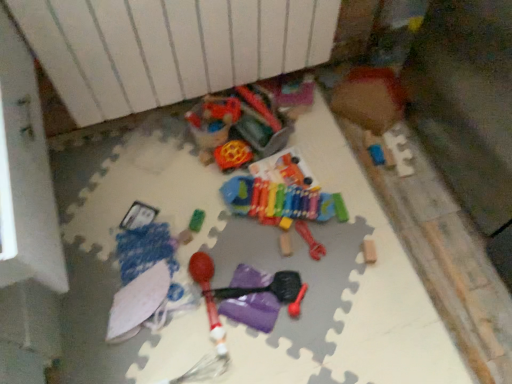
Question: Does green rubber toy at center, which is the 4th toy from top to bottom, come behind white matte umbrella at lower left, arranged as the second toy when ordered from the bottom?

Choices:
 (A) no
 (B) yes

Answer: (B)

Question: From a real-world perspective, does green rubber toy at center, which is the 4th toy from top to bottom, sit lower than white matte umbrella at lower left, arranged as the second toy when ordered from the bottom?

Choices:
 (A) yes
 (B) no

Answer: (B)

Question: Can you confirm if green rubber toy at center, positioned as the 6th toy in bottom-to-top order, is thinner than white matte umbrella at lower left, the eighth toy positioned from the top?

Choices:
 (A) yes
 (B) no

Answer: (A)

Question: Could you tell me if green rubber toy at center, which is the 4th toy from top to bottom, is facing white matte umbrella at lower left, arranged as the second toy when ordered from the bottom?

Choices:
 (A) yes
 (B) no

Answer: (B)

Question: Is green rubber toy at center, positioned as the 6th toy in bottom-to-top order, outside of white matte umbrella at lower left, arranged as the second toy when ordered from the bottom?

Choices:
 (A) yes
 (B) no

Answer: (A)

Question: Is wooden puzzle piece at upper right, the ninth toy from the bottom, wider or thinner than rubberized plastic ball at center, which ranks as the 2th toy in top-to-bottom order?

Choices:
 (A) thin
 (B) wide

Answer: (B)

Question: Is wooden puzzle piece at upper right, the first toy viewed from the top, inside or outside of rubberized plastic ball at center, which ranks as the 2th toy in top-to-bottom order?

Choices:
 (A) inside
 (B) outside

Answer: (B)

Question: From the image's perspective, is wooden puzzle piece at upper right, the ninth toy from the bottom, located above or below rubberized plastic ball at center, which ranks as the 2th toy in top-to-bottom order?

Choices:
 (A) above
 (B) below

Answer: (A)

Question: Is wooden puzzle piece at upper right, the ninth toy from the bottom, taller or shorter than rubberized plastic ball at center, the eighth toy positioned from the bottom?

Choices:
 (A) tall
 (B) short

Answer: (A)

Question: Is green rubber toy at center, which is the 4th toy from top to bottom, in front of or behind wooden puzzle piece at upper right, the first toy viewed from the top, in the image?

Choices:
 (A) front
 (B) behind

Answer: (A)

Question: Is point (190, 230) closer or farther from the camera than point (353, 79)?

Choices:
 (A) farther
 (B) closer

Answer: (B)

Question: Is green rubber toy at center, which is the 4th toy from top to bottom, bigger or smaller than wooden puzzle piece at upper right, the first toy viewed from the top?

Choices:
 (A) big
 (B) small

Answer: (B)

Question: Would you say green rubber toy at center, which is the 4th toy from top to bottom, is inside or outside wooden puzzle piece at upper right, the ninth toy from the bottom?

Choices:
 (A) outside
 (B) inside

Answer: (A)

Question: Considering the positions of white matte umbrella at lower left, arranged as the second toy when ordered from the bottom, and multicolored plastic xylophone at center, placed as the third toy when sorted from top to bottom, in the image, is white matte umbrella at lower left, arranged as the second toy when ordered from the bottom, wider or thinner than multicolored plastic xylophone at center, placed as the third toy when sorted from top to bottom,?

Choices:
 (A) wide
 (B) thin

Answer: (A)

Question: Based on their positions, is white matte umbrella at lower left, arranged as the second toy when ordered from the bottom, located to the left or right of multicolored plastic xylophone at center, which is the 7th toy in bottom-to-top order?

Choices:
 (A) right
 (B) left

Answer: (B)